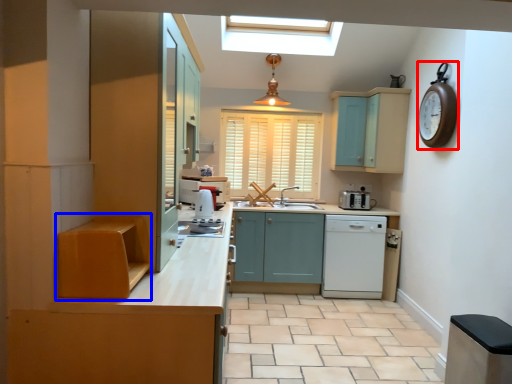
Question: Which point is closer to the camera, clock (highlighted by a red box) or cabinetry (highlighted by a blue box)?

Choices:
 (A) clock
 (B) cabinetry

Answer: (B)